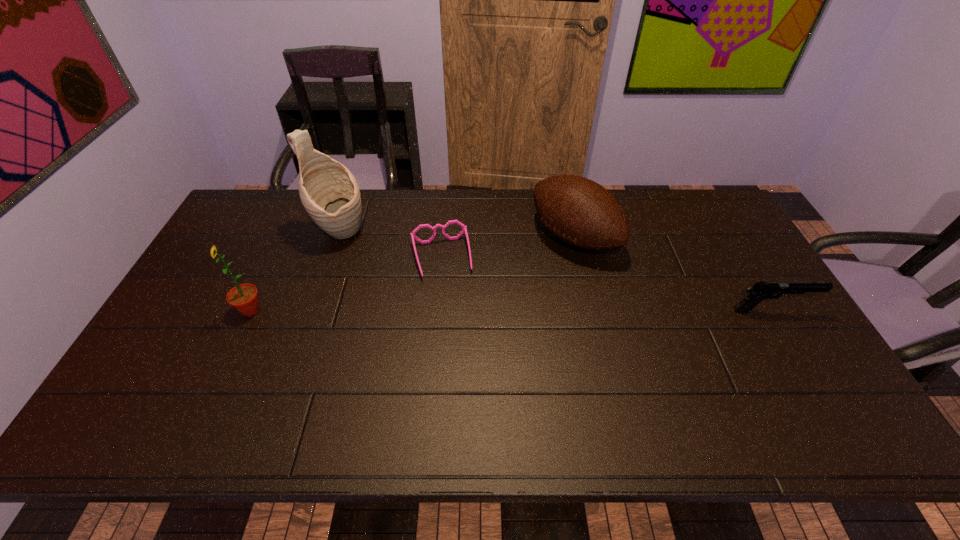
The height and width of the screenshot is (540, 960). Find the location of `free space located at the spout of the pitcher`. free space located at the spout of the pitcher is located at coordinates (432, 286).

The image size is (960, 540). In order to click on football at the far edge in this screenshot , I will do `click(582, 213)`.

Locate an element on the screen. The image size is (960, 540). pitcher that is positioned at the far edge is located at coordinates [329, 192].

This screenshot has width=960, height=540. I want to click on object that is at the right edge, so click(x=760, y=291).

Image resolution: width=960 pixels, height=540 pixels. Find the location of `free space at the far edge of the desktop`. free space at the far edge of the desktop is located at coordinates (512, 208).

In the image, there is a desktop. Identify the location of free space at the near edge. (510, 395).

The image size is (960, 540). Find the location of `vacant space at the left edge of the desktop`. vacant space at the left edge of the desktop is located at coordinates (180, 319).

This screenshot has height=540, width=960. In order to click on vacant region at the right edge in this screenshot , I will do `click(721, 242)`.

The width and height of the screenshot is (960, 540). What are the coordinates of `vacant space at the far left corner` in the screenshot? It's located at (248, 220).

In the image, there is a desktop. Identify the location of free space at the far right corner. (672, 201).